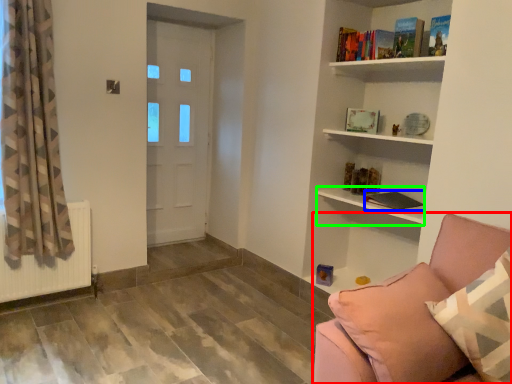
Question: Which is nearer to the studio couch (highlighted by a red box)? book (highlighted by a blue box) or shelf (highlighted by a green box).

Choices:
 (A) book
 (B) shelf

Answer: (B)